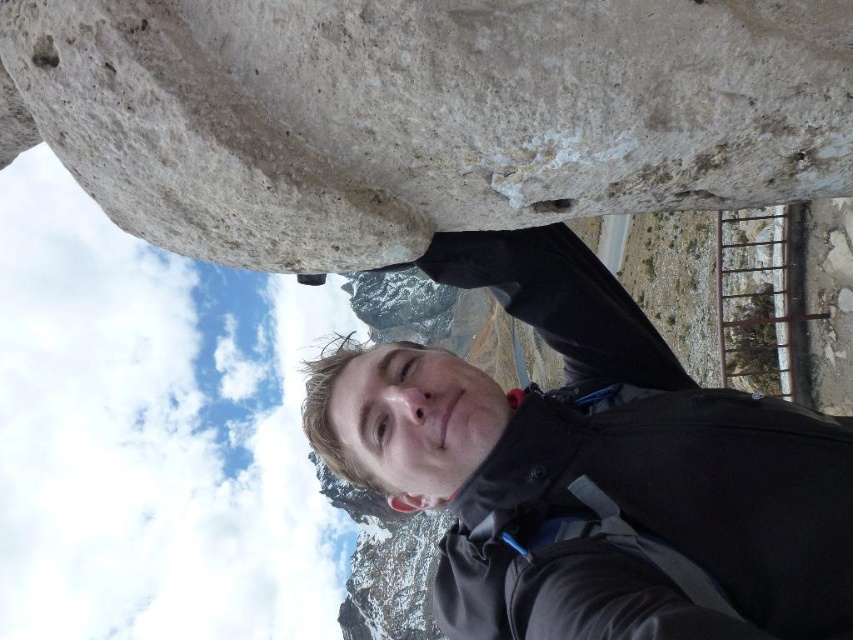
You are a photographer trying to capture the white rough stone at upper center in your shot. Based on its position, where should you aim your camera?

The white rough stone at upper center is located at the 2D coordinates point (426, 115), so you should aim your camera at that point to capture it.

Consider the image. You are a hiker planning to take a photo of the snowcapped mountains in the background. You have the white rough stone at upper center and the black matte jacket at center in your current view. Which object should you move closer to in order to frame the mountains better?

To frame the snowcapped mountains better, you should move closer to the white rough stone at upper center since it is positioned above the black matte jacket at center and can provide a better foreground element for the background mountains.